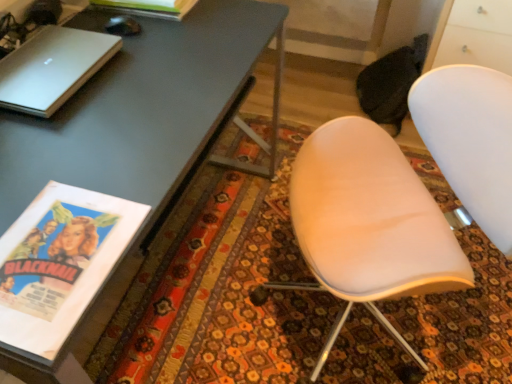
Question: Considering the relative sizes of black glossy mouse at upper left and white matte chair at center in the image provided, is black glossy mouse at upper left wider than white matte chair at center?

Choices:
 (A) yes
 (B) no

Answer: (B)

Question: Does black glossy mouse at upper left come in front of white matte chair at center?

Choices:
 (A) yes
 (B) no

Answer: (B)

Question: Is black glossy mouse at upper left facing towards white matte chair at center?

Choices:
 (A) yes
 (B) no

Answer: (B)

Question: Considering the relative positions of black glossy mouse at upper left and white matte chair at center in the image provided, is black glossy mouse at upper left to the right of white matte chair at center from the viewer's perspective?

Choices:
 (A) no
 (B) yes

Answer: (A)

Question: Is black glossy mouse at upper left not within white matte chair at center?

Choices:
 (A) no
 (B) yes

Answer: (B)

Question: Based on their sizes in the image, would you say matte paper magazine at upper left is bigger or smaller than white matte chair at center?

Choices:
 (A) small
 (B) big

Answer: (A)

Question: Considering the positions of point (188, 8) and point (410, 172), is point (188, 8) closer or farther from the camera than point (410, 172)?

Choices:
 (A) farther
 (B) closer

Answer: (A)

Question: Choose the correct answer: Is matte paper magazine at upper left inside white matte chair at center or outside it?

Choices:
 (A) outside
 (B) inside

Answer: (A)

Question: From a real-world perspective, is matte paper magazine at upper left physically located above or below white matte chair at center?

Choices:
 (A) below
 (B) above

Answer: (B)

Question: From their relative heights in the image, would you say white matte chair at center is taller or shorter than matte gray desk at upper left?

Choices:
 (A) short
 (B) tall

Answer: (B)

Question: From a real-world perspective, is white matte chair at center positioned above or below matte gray desk at upper left?

Choices:
 (A) above
 (B) below

Answer: (A)

Question: Based on their positions, is white matte chair at center located to the left or right of matte gray desk at upper left?

Choices:
 (A) right
 (B) left

Answer: (A)

Question: Considering the positions of white matte chair at center and matte gray desk at upper left in the image, is white matte chair at center wider or thinner than matte gray desk at upper left?

Choices:
 (A) wide
 (B) thin

Answer: (A)

Question: Is silver metallic laptop at upper left spatially inside matte gray desk at upper left, or outside of it?

Choices:
 (A) inside
 (B) outside

Answer: (A)

Question: From the image's perspective, is silver metallic laptop at upper left positioned above or below matte gray desk at upper left?

Choices:
 (A) below
 (B) above

Answer: (B)